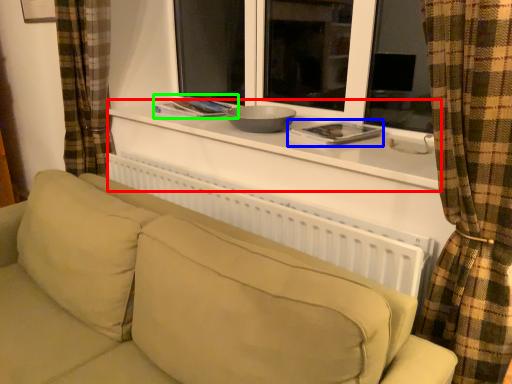
Question: Considering the real-world distances, which object is farthest from window sill (highlighted by a red box)? book (highlighted by a blue box) or book (highlighted by a green box)?

Choices:
 (A) book
 (B) book

Answer: (B)